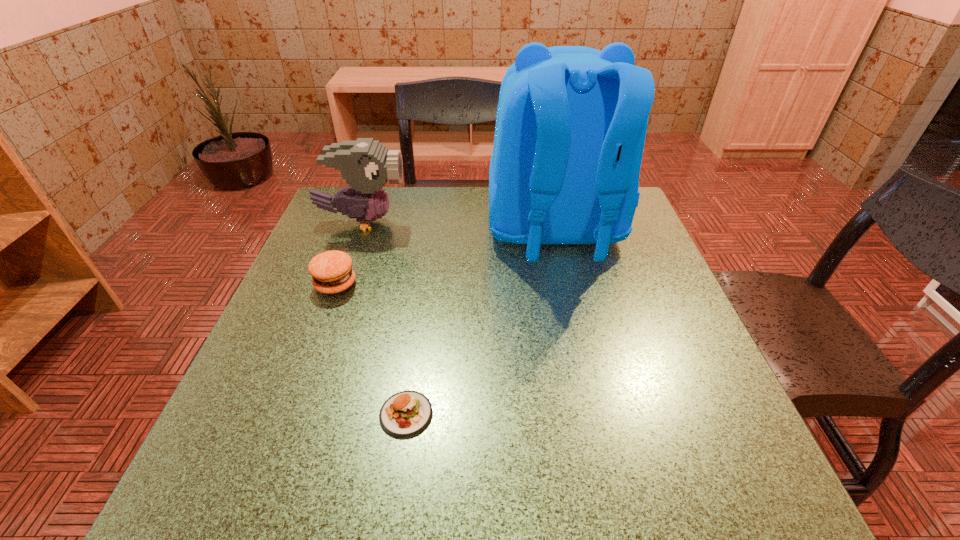
The image size is (960, 540). I want to click on backpack, so click(x=571, y=122).

Locate an element on the screen. This screenshot has height=540, width=960. the rightmost object is located at coordinates (571, 122).

You are a GUI agent. You are given a task and a screenshot of the screen. Output one action in this format:
    pyautogui.click(x=<x>, y=<y>)
    Task: Click on the bird
    Image resolution: width=960 pixels, height=540 pixels.
    Given the screenshot: What is the action you would take?
    pyautogui.click(x=366, y=165)

Locate an element on the screen. The height and width of the screenshot is (540, 960). the farther patty (food) is located at coordinates (332, 273).

Locate an element on the screen. The image size is (960, 540). the left patty (food) is located at coordinates (332, 273).

Where is `the third object from left to right`? the third object from left to right is located at coordinates tap(405, 414).

Locate an element on the screen. the right patty (food) is located at coordinates (405, 414).

The image size is (960, 540). In order to click on free space located 0.160m on the back of the tallest object in this screenshot , I will do `click(579, 338)`.

The image size is (960, 540). In order to click on vacant space located 0.200m at the beak of the bird in this screenshot , I will do `click(485, 222)`.

Locate an element on the screen. free region located on the front of the second shortest object is located at coordinates (304, 368).